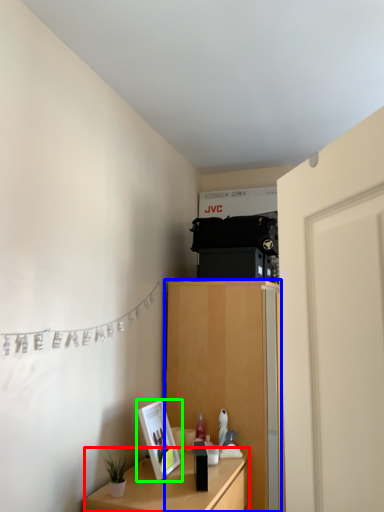
Question: Based on their relative distances, which object is farther from table (highlighted by a red box)? Choose from cabinetry (highlighted by a blue box) and picture frame (highlighted by a green box).

Choices:
 (A) cabinetry
 (B) picture frame

Answer: (A)